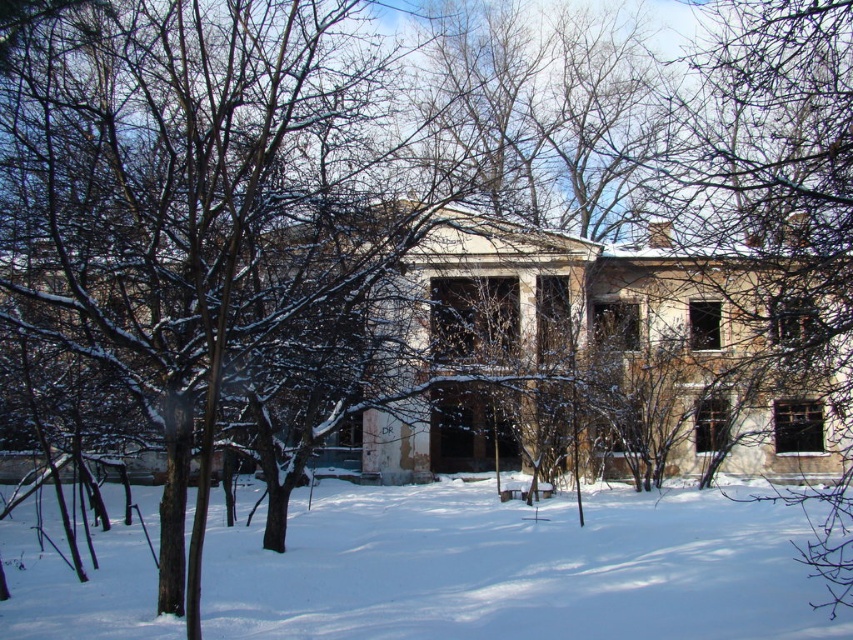
Question: Is white powdery snow at center wider than brown bark tree at right?

Choices:
 (A) no
 (B) yes

Answer: (B)

Question: Among these objects, which one is farthest from the camera?

Choices:
 (A) white powdery snow at center
 (B) brown bark tree at right

Answer: (A)

Question: Which point is closer to the camera?

Choices:
 (A) (701, 120)
 (B) (730, 500)

Answer: (B)

Question: Which point appears farthest from the camera in this image?

Choices:
 (A) (668, 177)
 (B) (584, 508)

Answer: (A)

Question: From the image, what is the correct spatial relationship of white powdery snow at center in relation to brown bark tree at right?

Choices:
 (A) left
 (B) right

Answer: (A)

Question: Where is white powdery snow at center located in relation to brown bark tree at right in the image?

Choices:
 (A) right
 (B) left

Answer: (B)